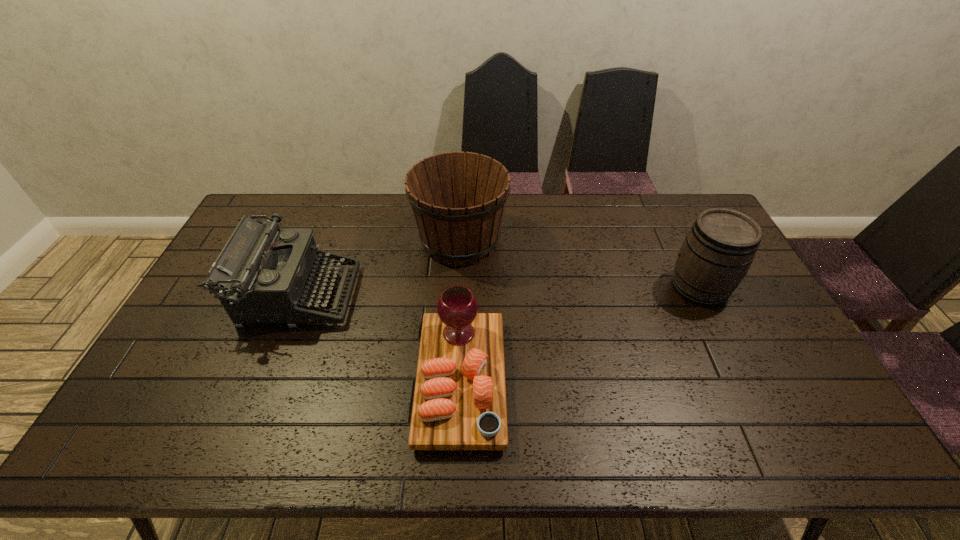
The width and height of the screenshot is (960, 540). What are the coordinates of `free space that satisfies the following two spatial constraints: 1. on the typing side of the platter; 2. on the right side of the typewriter` in the screenshot? It's located at (264, 381).

Locate an element on the screen. This screenshot has height=540, width=960. vacant space that satisfies the following two spatial constraints: 1. on the back side of the platter; 2. on the typing side of the typewriter is located at coordinates (465, 295).

Where is `vacant area in the image that satisfies the following two spatial constraints: 1. on the typing side of the platter; 2. on the left side of the typewriter`? vacant area in the image that satisfies the following two spatial constraints: 1. on the typing side of the platter; 2. on the left side of the typewriter is located at coordinates (264, 381).

This screenshot has height=540, width=960. In order to click on vacant space that satisfies the following two spatial constraints: 1. on the front side of the platter; 2. on the right side of the left wine bucket in this screenshot , I will do `click(453, 381)`.